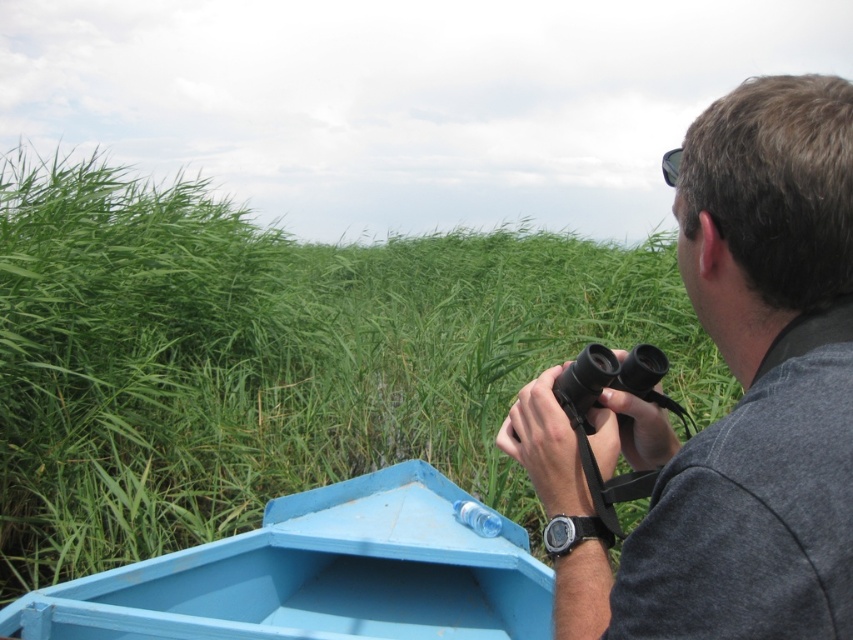
Question: Which object is closer to the camera taking this photo?

Choices:
 (A) green grass at center
 (B) light blue painted wood boat at lower left
 (C) gray fabric shirt at upper right

Answer: (C)

Question: Is green grass at center wider than light blue painted wood boat at lower left?

Choices:
 (A) yes
 (B) no

Answer: (A)

Question: Which object is positioned closest to the green grass at center?

Choices:
 (A) gray fabric shirt at upper right
 (B) light blue painted wood boat at lower left

Answer: (B)

Question: Can you confirm if gray fabric shirt at upper right is bigger than light blue painted wood boat at lower left?

Choices:
 (A) no
 (B) yes

Answer: (A)

Question: Is green grass at center wider than light blue painted wood boat at lower left?

Choices:
 (A) yes
 (B) no

Answer: (A)

Question: Which is nearer to the green grass at center?

Choices:
 (A) light blue painted wood boat at lower left
 (B) gray fabric shirt at upper right

Answer: (A)